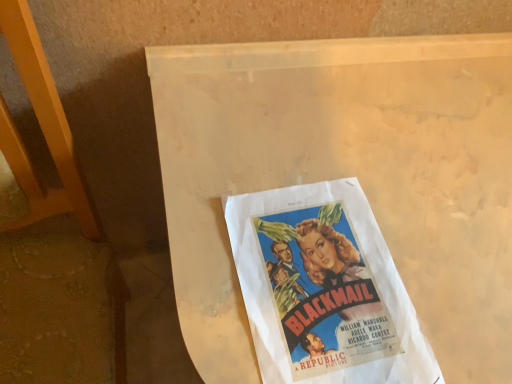
Question: From the image's perspective, relative to white matte paper at center, is vintage paper poster at center above or below?

Choices:
 (A) below
 (B) above

Answer: (B)

Question: Based on their positions, is vintage paper poster at center located to the left or right of white matte paper at center?

Choices:
 (A) left
 (B) right

Answer: (A)

Question: Relative to white matte paper at center, is vintage paper poster at center in front or behind?

Choices:
 (A) front
 (B) behind

Answer: (B)

Question: Is white matte paper at center to the left or to the right of vintage paper poster at center in the image?

Choices:
 (A) right
 (B) left

Answer: (A)

Question: Is white matte paper at center inside the boundaries of vintage paper poster at center, or outside?

Choices:
 (A) outside
 (B) inside

Answer: (A)

Question: In terms of size, does white matte paper at center appear bigger or smaller than vintage paper poster at center?

Choices:
 (A) big
 (B) small

Answer: (A)

Question: Is white matte paper at center in front of or behind vintage paper poster at center in the image?

Choices:
 (A) front
 (B) behind

Answer: (A)